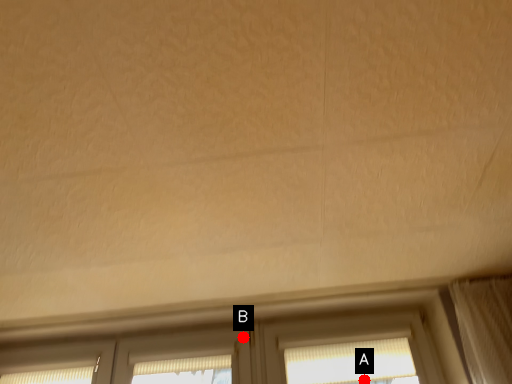
Question: Two points are circled on the image, labeled by A and B beside each circle. Which point appears closest to the camera in this image?

Choices:
 (A) A is closer
 (B) B is closer

Answer: (A)